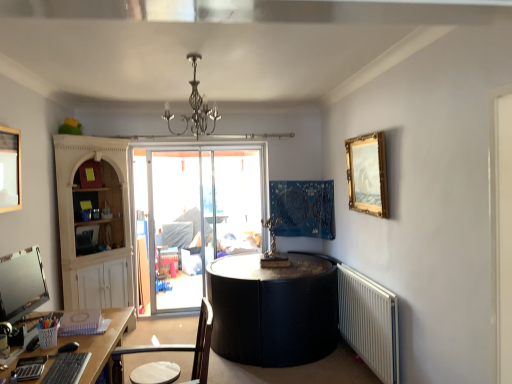
Question: Considering the positions of wooden picture frame at upper left, positioned as the second picture frame in right-to-left order, and metallic chandelier at upper center in the image, is wooden picture frame at upper left, positioned as the second picture frame in right-to-left order, taller or shorter than metallic chandelier at upper center?

Choices:
 (A) tall
 (B) short

Answer: (A)

Question: Does point (0, 168) appear closer or farther from the camera than point (197, 87)?

Choices:
 (A) farther
 (B) closer

Answer: (A)

Question: Which object is positioned farthest from the brown wooden chair at lower left?

Choices:
 (A) matte black monitor at lower left
 (B) gold/gilded picture frame at upper right, arranged as the second picture frame when viewed from the front
 (C) metallic chandelier at upper center
 (D) white plastic radiator at lower right
 (E) wooden picture frame at upper left, positioned as the second picture frame in right-to-left order

Answer: (B)

Question: Based on their relative distances, which object is farther from the matte black monitor at lower left?

Choices:
 (A) gold/gilded picture frame at upper right, which ranks as the 1th picture frame in back-to-front order
 (B) white plastic radiator at lower right
 (C) metallic chandelier at upper center
 (D) wooden picture frame at upper left, acting as the 1th picture frame starting from the left
 (E) brown wooden chair at lower left

Answer: (A)